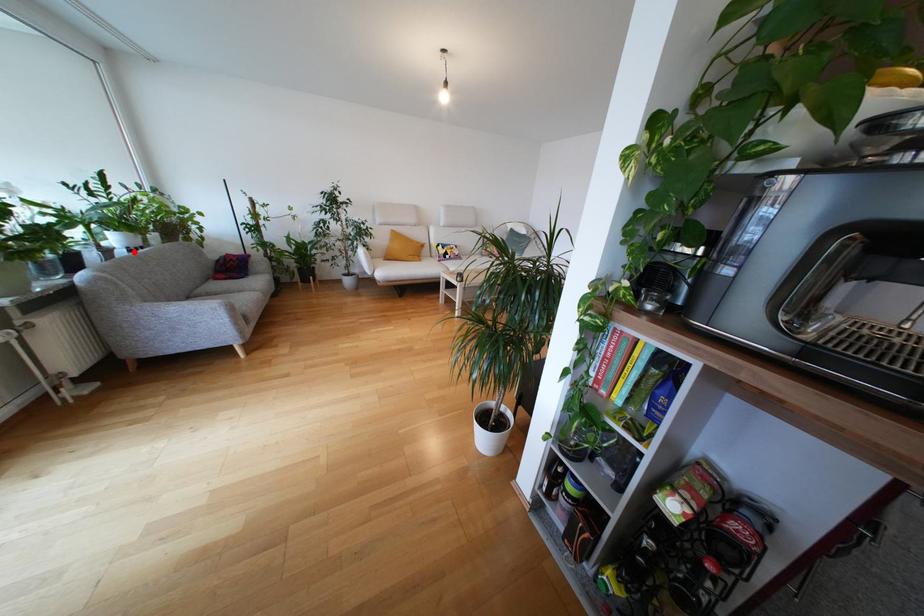
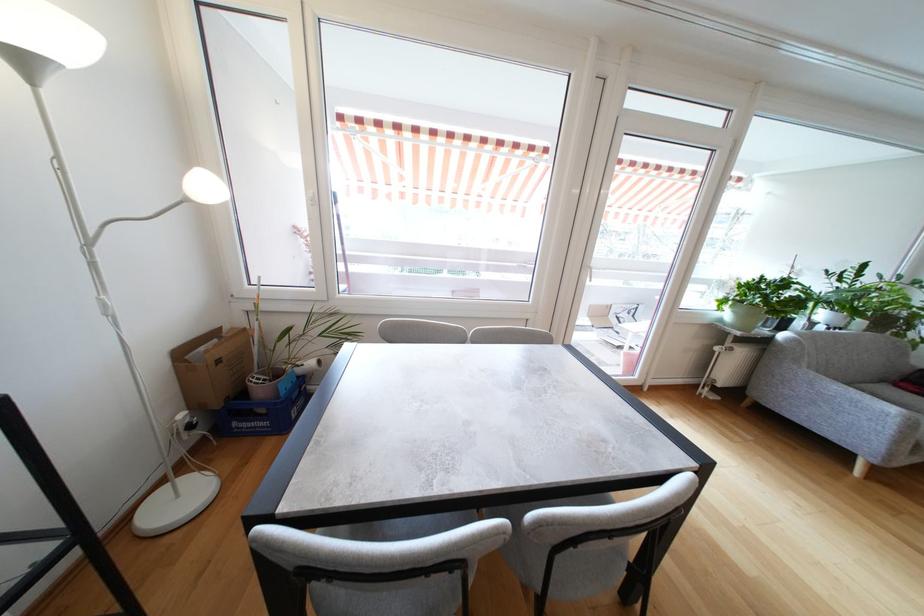
Find the pixel in the second image that matches the highlighted location in the first image.

(833, 330)